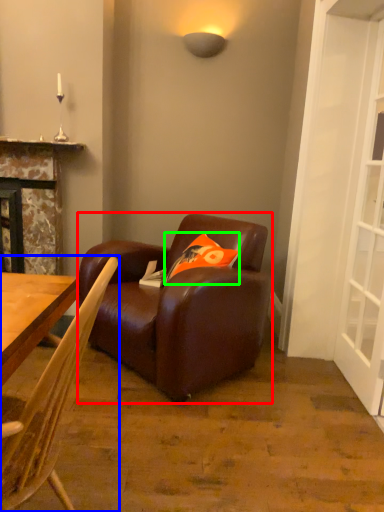
Question: Considering the real-world distances, which object is closest to studio couch (highlighted by a red box)? chair (highlighted by a blue box) or pillow (highlighted by a green box).

Choices:
 (A) chair
 (B) pillow

Answer: (B)